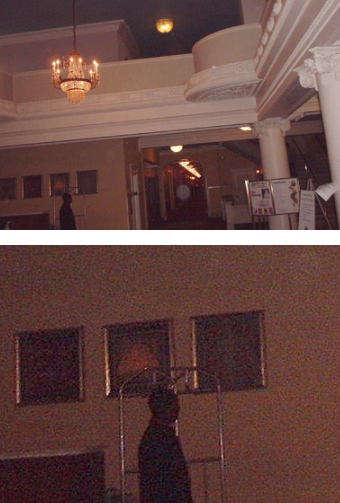
Find the location of `chandelier`. chandelier is located at coordinates (84, 78), (167, 22).